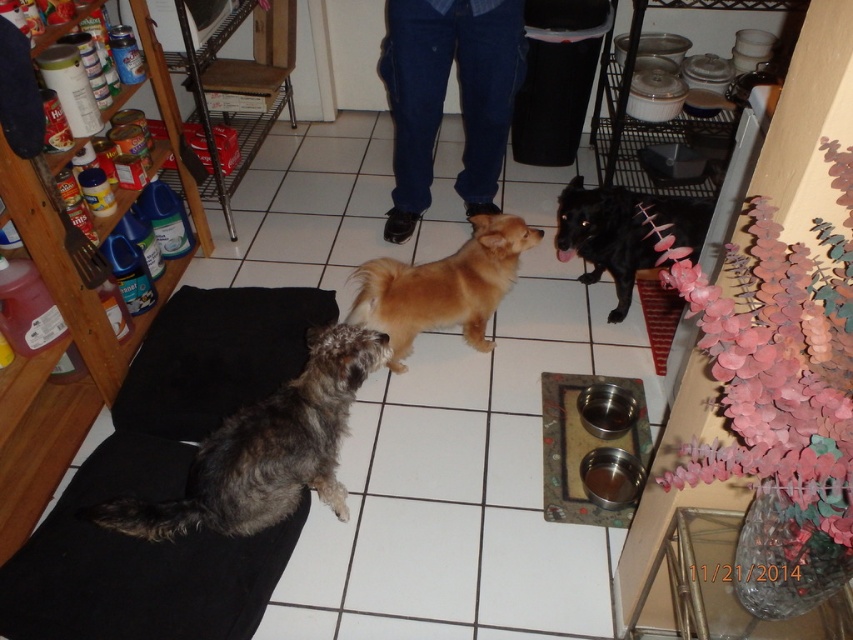
Consider the image. Is gray shaggy dog at lower left closer to camera compared to golden fur dog at center?

Yes, gray shaggy dog at lower left is closer to the viewer.

In the scene shown: Is gray shaggy dog at lower left smaller than golden fur dog at center?

Correct, gray shaggy dog at lower left occupies less space than golden fur dog at center.

Does point (329, 344) come behind point (474, 218)?

No, (329, 344) is closer to viewer.

Find the location of `gray shaggy dog at lower left`. gray shaggy dog at lower left is located at coordinates (265, 449).

Is blue jeans at center smaller than black glossy dog at center?

Incorrect, blue jeans at center is not smaller in size than black glossy dog at center.

Looking at this image, how far apart are blue jeans at center and black glossy dog at center?

blue jeans at center and black glossy dog at center are 23.43 inches apart from each other.

The width and height of the screenshot is (853, 640). Find the location of `blue jeans at center`. blue jeans at center is located at coordinates (444, 97).

The image size is (853, 640). I want to click on blue jeans at center, so click(444, 97).

Does gray shaggy dog at lower left come in front of black glossy dog at center?

Yes, gray shaggy dog at lower left is closer to the viewer.

Measure the distance from gray shaggy dog at lower left to black glossy dog at center.

They are 3.54 feet apart.

Is point (230, 422) farther from viewer compared to point (569, 193)?

No, (230, 422) is in front of (569, 193).

You are a GUI agent. You are given a task and a screenshot of the screen. Output one action in this format:
    pyautogui.click(x=<x>, y=<y>)
    Task: Click on the gray shaggy dog at lower left
    Image resolution: width=853 pixels, height=640 pixels.
    Given the screenshot: What is the action you would take?
    pyautogui.click(x=265, y=449)